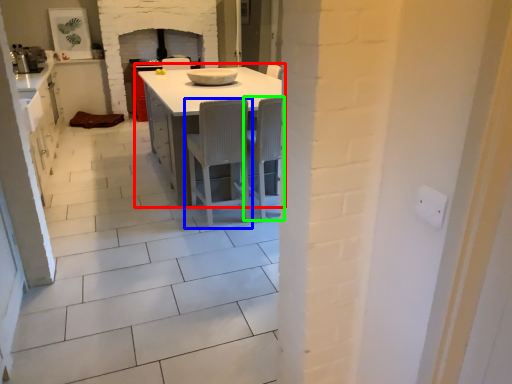
Question: Which object is the farthest from table (highlighted by a red box)? Choose among these: chair (highlighted by a blue box) or chair (highlighted by a green box).

Choices:
 (A) chair
 (B) chair

Answer: (B)